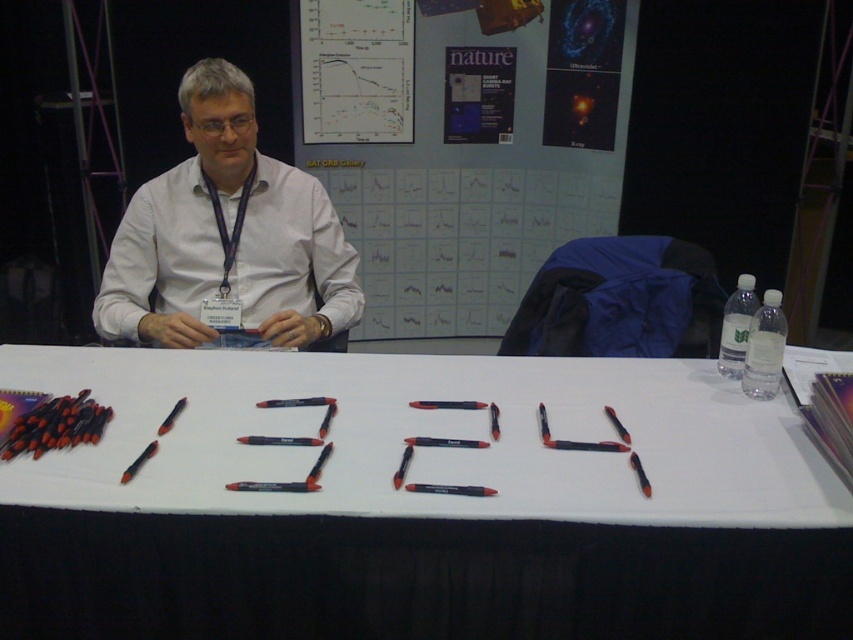
Is white paper at center thinner than matte paper poster at upper center?

No, white paper at center is not thinner than matte paper poster at upper center.

Between white paper at center and matte paper poster at upper center, which one is positioned higher?

matte paper poster at upper center

Is point (473, 390) closer to camera compared to point (543, 132)?

Yes, it is.

This screenshot has height=640, width=853. Find the location of `white paper at center`. white paper at center is located at coordinates (421, 506).

Which is in front, point (306, 624) or point (144, 289)?

Positioned in front is point (306, 624).

Identify the location of white paper at center. The height and width of the screenshot is (640, 853). (421, 506).

In order to click on white paper at center in this screenshot , I will do 421,506.

Which is above, matte paper poster at upper center or white matte shirt at center?

Positioned higher is matte paper poster at upper center.

Which is in front, point (612, 52) or point (109, 276)?

Point (109, 276) is in front.

Between point (473, 288) and point (276, 228), which one is positioned in front?

Positioned in front is point (276, 228).

The width and height of the screenshot is (853, 640). I want to click on matte paper poster at upper center, so click(x=461, y=145).